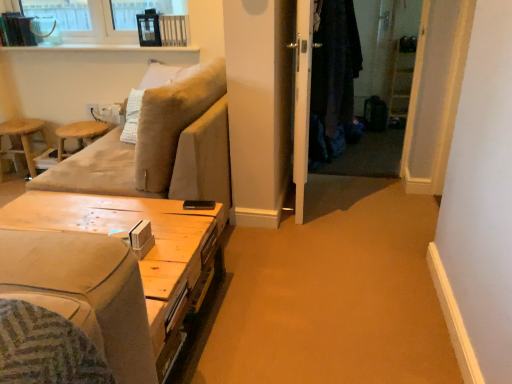
Identify the location of beige fabric couch at left. (160, 148).

Image resolution: width=512 pixels, height=384 pixels. Describe the element at coordinates (160, 148) in the screenshot. I see `beige fabric couch at left` at that location.

Measure the distance between wooden stool at left, acting as the second bar stool starting from the right, and camera.

They are 2.89 meters apart.

The width and height of the screenshot is (512, 384). Describe the element at coordinates (110, 266) in the screenshot. I see `woodenmaterial/texturetable at lower left` at that location.

Measure the distance between point (x=343, y=38) and camera.

They are 2.25 meters apart.

Describe the element at coordinates (302, 101) in the screenshot. I see `white glossy screen door at center` at that location.

Find the location of a particular element. This screenshot has height=384, width=512. wooden bar stool at left, positioned as the 2th bar stool in left-to-right order is located at coordinates (79, 135).

Considering the sizes of beige fabric couch at left and wooden stool at left, arranged as the 1th bar stool when viewed from the left, in the image, is beige fabric couch at left wider or thinner than wooden stool at left, arranged as the 1th bar stool when viewed from the left,?

Considering their sizes, beige fabric couch at left looks broader than wooden stool at left, arranged as the 1th bar stool when viewed from the left.

From the image's perspective, which is above, beige fabric couch at left or wooden stool at left, acting as the second bar stool starting from the right?

wooden stool at left, acting as the second bar stool starting from the right, appears higher in the image.

Which is in front, beige fabric couch at left or wooden stool at left, acting as the second bar stool starting from the right?

beige fabric couch at left.

Which is further, (145, 169) or (2, 171)?

The point (2, 171) is more distant.

From the image's perspective, is woodenmaterial/texturetable at lower left positioned above or below dark woolen robe at center?

woodenmaterial/texturetable at lower left is below dark woolen robe at center.

Is woodenmaterial/texturetable at lower left further to camera compared to dark woolen robe at center?

That is False.

Is woodenmaterial/texturetable at lower left next to dark woolen robe at center?

woodenmaterial/texturetable at lower left and dark woolen robe at center are clearly separated.

Can you tell me how much woodenmaterial/texturetable at lower left and dark woolen robe at center differ in facing direction?

woodenmaterial/texturetable at lower left and dark woolen robe at center are facing 176 degrees away from each other.

From the image's perspective, which one is positioned lower, woodenmaterial/texturetable at lower left or wooden bar stool at left, which is the 1th bar stool from right to left?

woodenmaterial/texturetable at lower left appears lower in the image.

Is woodenmaterial/texturetable at lower left spatially inside wooden bar stool at left, which is the 1th bar stool from right to left, or outside of it?

woodenmaterial/texturetable at lower left is located beyond the bounds of wooden bar stool at left, which is the 1th bar stool from right to left.

Is woodenmaterial/texturetable at lower left positioned far away from wooden bar stool at left, positioned as the 2th bar stool in left-to-right order?

Yes, woodenmaterial/texturetable at lower left is far from wooden bar stool at left, positioned as the 2th bar stool in left-to-right order.

Between wooden stool at left, arranged as the 1th bar stool when viewed from the left, and wooden bar stool at left, which is the 1th bar stool from right to left, which one is positioned behind?

wooden stool at left, arranged as the 1th bar stool when viewed from the left, is further from the camera.

Can you confirm if wooden stool at left, acting as the second bar stool starting from the right, is wider than wooden bar stool at left, which is the 1th bar stool from right to left?

Yes.

Would you say wooden bar stool at left, positioned as the 2th bar stool in left-to-right order, is part of wooden stool at left, acting as the second bar stool starting from the right,'s contents?

No, wooden bar stool at left, positioned as the 2th bar stool in left-to-right order, is not a part of wooden stool at left, acting as the second bar stool starting from the right.

Between wooden stool at left, arranged as the 1th bar stool when viewed from the left, and wooden bar stool at left, which is the 1th bar stool from right to left, which one has less height?

wooden bar stool at left, which is the 1th bar stool from right to left.

Consider the image. Does wooden stool at left, arranged as the 1th bar stool when viewed from the left, turn towards dark woolen robe at center?

No, wooden stool at left, arranged as the 1th bar stool when viewed from the left, does not turn towards dark woolen robe at center.

Is the depth of wooden stool at left, acting as the second bar stool starting from the right, greater than that of dark woolen robe at center?

Yes, it is behind dark woolen robe at center.

From a real-world perspective, is wooden stool at left, arranged as the 1th bar stool when viewed from the left, on dark woolen robe at center?

Incorrect, from a real-world perspective, wooden stool at left, arranged as the 1th bar stool when viewed from the left, is lower than dark woolen robe at center.

Is dark woolen robe at center located within wooden stool at left, acting as the second bar stool starting from the right?

Actually, dark woolen robe at center is outside wooden stool at left, acting as the second bar stool starting from the right.

Does beige fabric couch at left have a greater width compared to wooden bar stool at left, which is the 1th bar stool from right to left?

Correct, the width of beige fabric couch at left exceeds that of wooden bar stool at left, which is the 1th bar stool from right to left.

Can you confirm if beige fabric couch at left is bigger than wooden bar stool at left, which is the 1th bar stool from right to left?

Yes.

From a real-world perspective, which is physically below, beige fabric couch at left or wooden bar stool at left, which is the 1th bar stool from right to left?

wooden bar stool at left, which is the 1th bar stool from right to left.

Find the location of `table directly beneath the dark woolen robe at center (from a real-world perspective)`. table directly beneath the dark woolen robe at center (from a real-world perspective) is located at coordinates (110, 266).

Considering the sizes of dark woolen robe at center and woodenmaterial/texturetable at lower left in the image, is dark woolen robe at center bigger or smaller than woodenmaterial/texturetable at lower left?

Clearly, dark woolen robe at center is smaller in size than woodenmaterial/texturetable at lower left.

Considering the sizes of objects dark woolen robe at center and woodenmaterial/texturetable at lower left in the image provided, who is wider, dark woolen robe at center or woodenmaterial/texturetable at lower left?

woodenmaterial/texturetable at lower left.

Is dark woolen robe at center aimed at woodenmaterial/texturetable at lower left?

No.

From a real-world perspective, count 2nd bar stools downward from the beige fabric couch at left and point to it. Please provide its 2D coordinates.

[(23, 140)]

Identify the location of robe above the woodenmaterial/texturetable at lower left (from a real-world perspective). (334, 82).

Looking at this image, considering their positions, is beige fabric couch at left positioned further to woodenmaterial/texturetable at lower left than white glossy screen door at center?

white glossy screen door at center.

When comparing their distances from beige fabric couch at left, does white glossy screen door at center or dark woolen robe at center seem closer?

The object closer to beige fabric couch at left is white glossy screen door at center.

When comparing their distances from wooden stool at left, arranged as the 1th bar stool when viewed from the left, does beige fabric couch at left or white glossy screen door at center seem closer?

Based on the image, beige fabric couch at left appears to be nearer to wooden stool at left, arranged as the 1th bar stool when viewed from the left.

When comparing their distances from dark woolen robe at center, does woodenmaterial/texturetable at lower left or beige fabric couch at left seem further?

woodenmaterial/texturetable at lower left.

Considering their positions, is dark woolen robe at center positioned further to woodenmaterial/texturetable at lower left than beige fabric couch at left?

dark woolen robe at center lies further to woodenmaterial/texturetable at lower left than the other object.

Based on their spatial positions, is beige fabric couch at left or woodenmaterial/texturetable at lower left closer to wooden bar stool at left, which is the 1th bar stool from right to left?

Based on the image, beige fabric couch at left appears to be nearer to wooden bar stool at left, which is the 1th bar stool from right to left.

Based on their spatial positions, is wooden bar stool at left, positioned as the 2th bar stool in left-to-right order, or dark woolen robe at center closer to woodenmaterial/texturetable at lower left?

Among the two, wooden bar stool at left, positioned as the 2th bar stool in left-to-right order, is located nearer to woodenmaterial/texturetable at lower left.

Based on their spatial positions, is wooden stool at left, arranged as the 1th bar stool when viewed from the left, or wooden bar stool at left, positioned as the 2th bar stool in left-to-right order, closer to woodenmaterial/texturetable at lower left?

The object closer to woodenmaterial/texturetable at lower left is wooden bar stool at left, positioned as the 2th bar stool in left-to-right order.

Locate an element on the screen. The image size is (512, 384). bar stool situated between wooden stool at left, acting as the second bar stool starting from the right, and dark woolen robe at center from left to right is located at coordinates (79, 135).

Where is `screen door situated between woodenmaterial/texturetable at lower left and dark woolen robe at center from left to right`? screen door situated between woodenmaterial/texturetable at lower left and dark woolen robe at center from left to right is located at coordinates (302, 101).

Where is `studio couch between woodenmaterial/texturetable at lower left and wooden bar stool at left, which is the 1th bar stool from right to left, from front to back`? The width and height of the screenshot is (512, 384). studio couch between woodenmaterial/texturetable at lower left and wooden bar stool at left, which is the 1th bar stool from right to left, from front to back is located at coordinates (160, 148).

Where is `screen door between beige fabric couch at left and dark woolen robe at center in the horizontal direction`? This screenshot has height=384, width=512. screen door between beige fabric couch at left and dark woolen robe at center in the horizontal direction is located at coordinates (302, 101).